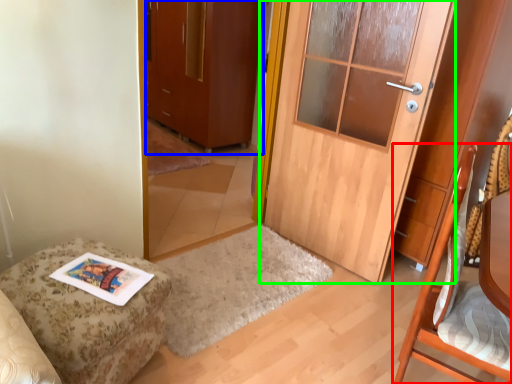
Question: Which object is positioned farthest from chair (highlighted by a red box)? Select from cabinetry (highlighted by a blue box) and door (highlighted by a green box).

Choices:
 (A) cabinetry
 (B) door

Answer: (A)